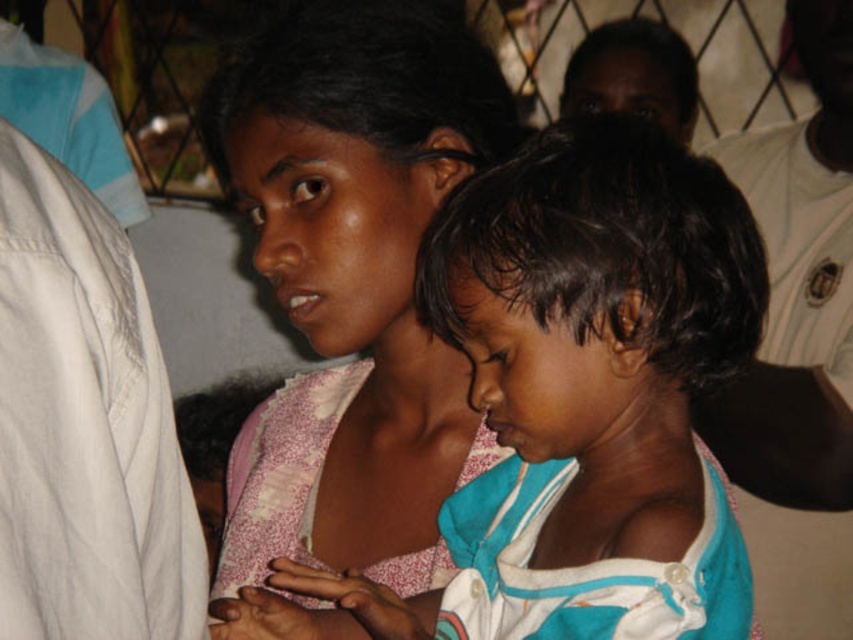
You are a fashion designer observing the scene. You notice the light blue fabric shirt at center and the pink fabric at center. Which fabric is positioned lower in the image?

The light blue fabric shirt at center is located below the pink fabric at center, so it is positioned lower in the image.

You are a photographer standing 10 feet away from the light blue fabric shirt at center and the pink fabric at center. You want to take a photo that includes both items in the frame. Given their distance apart, will you need to zoom in or zoom out to ensure both are fully visible?

The light blue fabric shirt at center is 7.31 inches away from the pink fabric at center. Since you are 10 feet away, the distance between them is relatively small, so you can zoom out slightly to ensure both are fully visible in the frame.